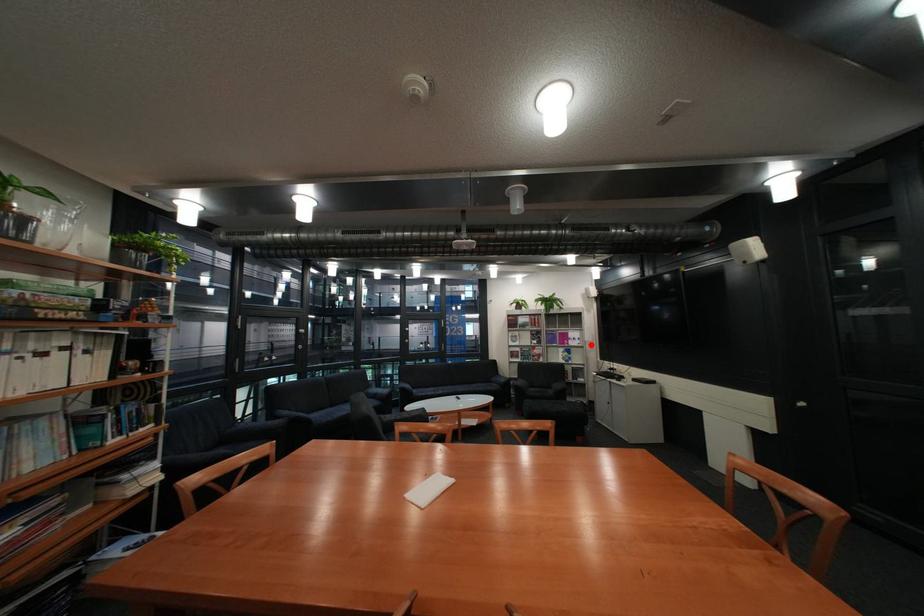
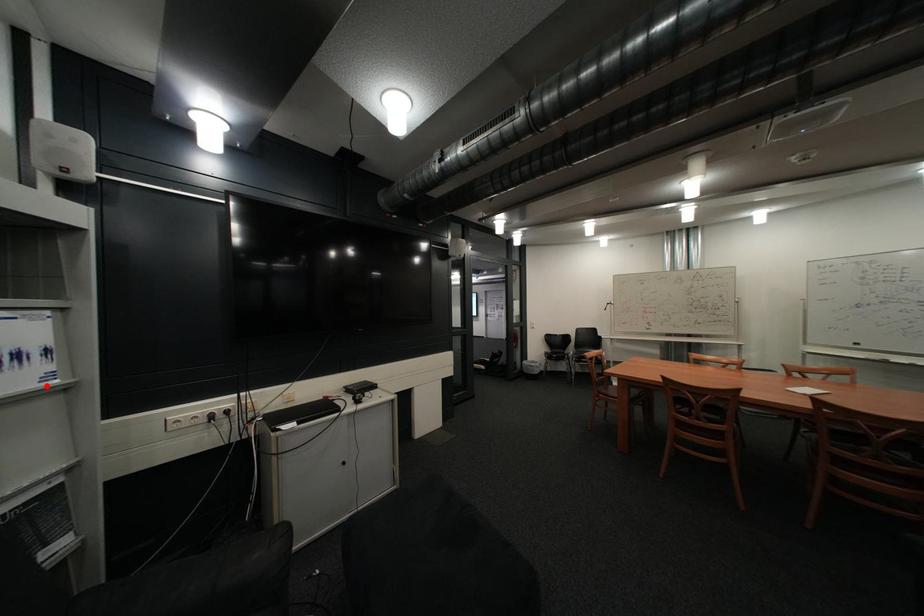
I am providing you with two images of the same scene from different viewpoints. A red point is marked on the first image and another point is marked on the second image. Is the marked point in image1 the same physical position as the marked point in image2?

Yes